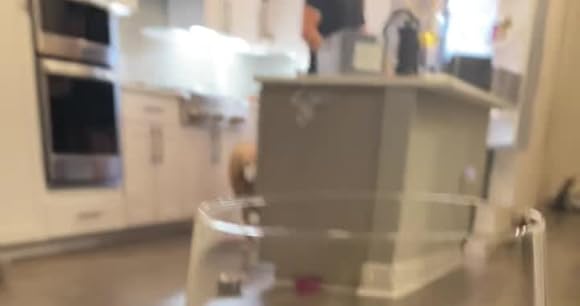
What are the coordinates of `handles` in the screenshot? It's located at (160, 148), (152, 140), (154, 111).